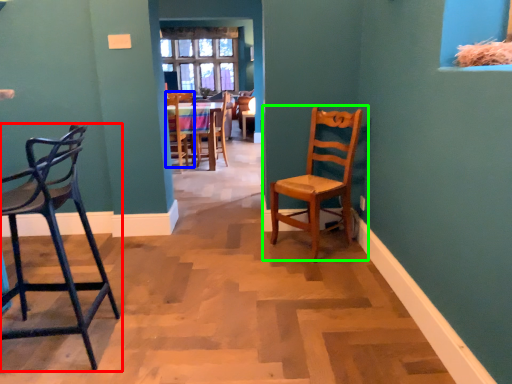
Question: Which object is positioned closest to chair (highlighted by a red box)? Select from chair (highlighted by a blue box) and chair (highlighted by a green box).

Choices:
 (A) chair
 (B) chair

Answer: (B)